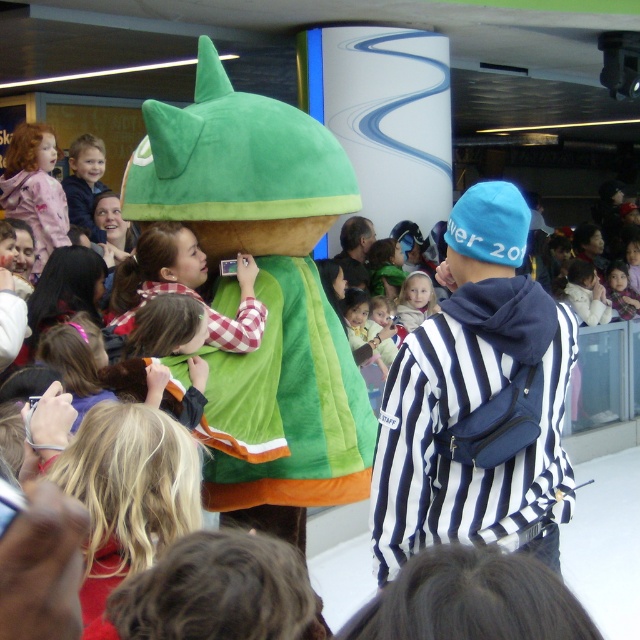
Question: Is blue fleece beanie at upper right to the left of smooth beige shirt at center from the viewer's perspective?

Choices:
 (A) yes
 (B) no

Answer: (A)

Question: Does blue fleece beanie at upper right appear on the right side of smooth beige shirt at center?

Choices:
 (A) no
 (B) yes

Answer: (A)

Question: Among these points, which one is nearest to the camera?

Choices:
 (A) (422, 280)
 (B) (456, 307)

Answer: (B)

Question: Which point appears farthest from the camera in this image?

Choices:
 (A) (499, 307)
 (B) (416, 321)

Answer: (B)

Question: Considering the relative positions of blue fleece beanie at upper right and smooth beige shirt at center in the image provided, where is blue fleece beanie at upper right located with respect to smooth beige shirt at center?

Choices:
 (A) right
 (B) left

Answer: (B)

Question: Which object is farther from the camera taking this photo?

Choices:
 (A) blue fleece beanie at upper right
 (B) smooth beige shirt at center

Answer: (B)